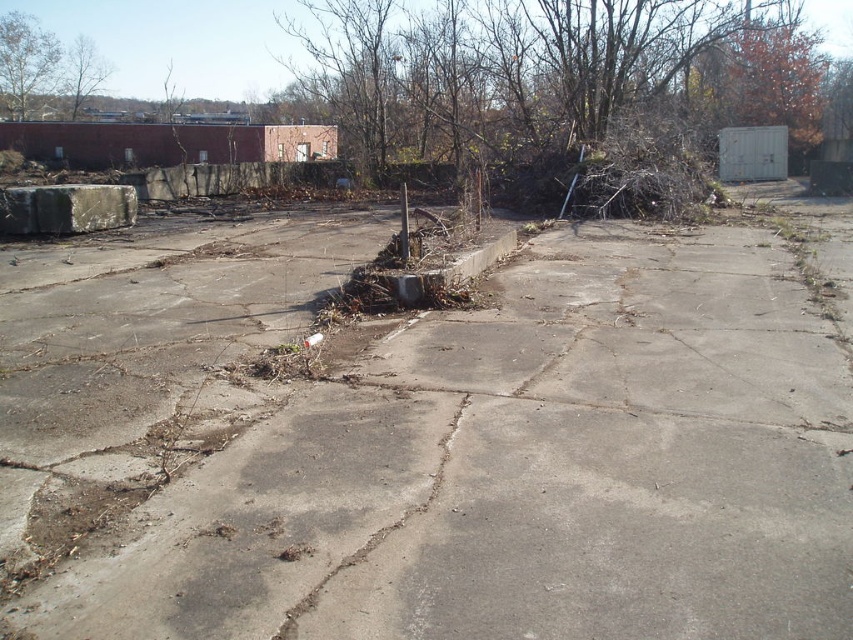
You are a surveyor using a coordinate system where the bottom left corner is the origin point. You need to locate the gray concrete block at left. What are its coordinates?

The gray concrete block at left is located at coordinates point (67, 209).

You are standing at the point marked as point (67, 209) in the image. What object is located at that point?

The point (67, 209) indicates a gray concrete block at left.